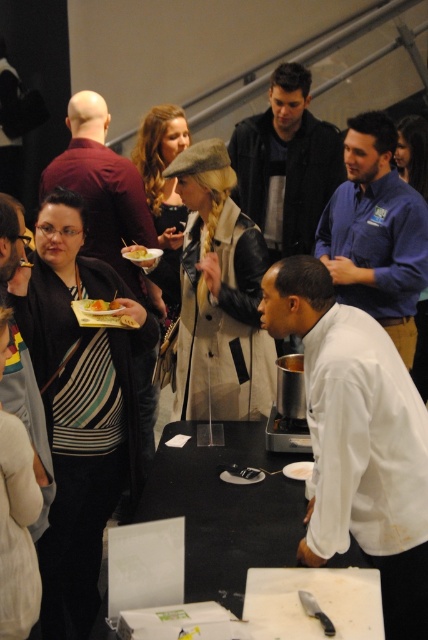
Does black matte table at center appear over yellowish matte plate at center?

Incorrect, black matte table at center is not positioned above yellowish matte plate at center.

Can you confirm if black matte table at center is bigger than yellowish matte plate at center?

Correct, black matte table at center is larger in size than yellowish matte plate at center.

Is point (247, 492) farther from camera compared to point (95, 307)?

No.

This screenshot has width=428, height=640. Find the location of `black matte table at center`. black matte table at center is located at coordinates (225, 509).

Between point (284, 216) and point (130, 248), which one is positioned in front?

Point (130, 248) is more forward.

Is black leather jacket at upper center to the right of matte yellow plate at center from the viewer's perspective?

Indeed, black leather jacket at upper center is positioned on the right side of matte yellow plate at center.

Is point (291, 212) farther from camera compared to point (151, 253)?

Yes, it is.

The width and height of the screenshot is (428, 640). In order to click on black leather jacket at upper center in this screenshot , I will do `click(287, 163)`.

In the scene shown: Does black matte table at center appear on the left side of black leather jacket at upper center?

Yes, black matte table at center is to the left of black leather jacket at upper center.

Looking at this image, does black matte table at center appear on the right side of black leather jacket at upper center?

Incorrect, black matte table at center is not on the right side of black leather jacket at upper center.

Who is more forward, (297, 488) or (267, 154)?

Point (297, 488) is in front.

The height and width of the screenshot is (640, 428). I want to click on black matte table at center, so click(x=225, y=509).